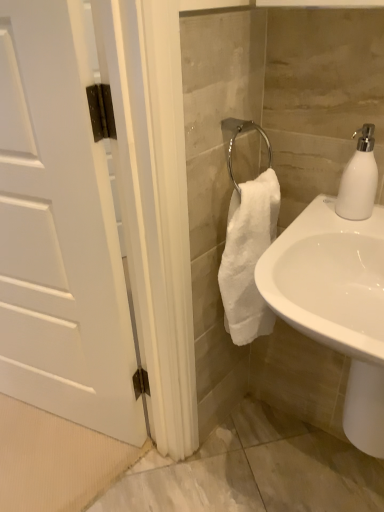
The width and height of the screenshot is (384, 512). In order to click on free space to the left of white matte soap dispenser at upper right in this screenshot , I will do `click(309, 224)`.